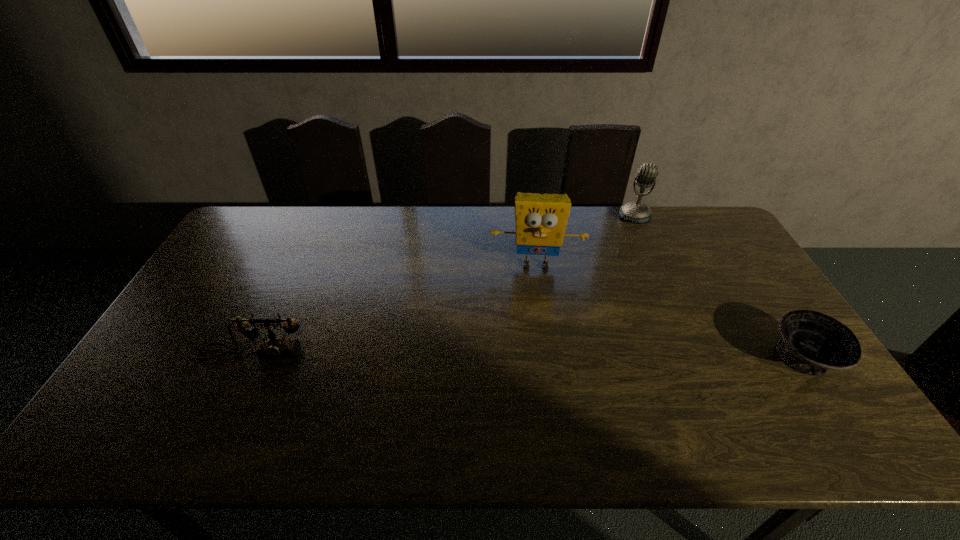
The height and width of the screenshot is (540, 960). I want to click on object located at the near right corner, so click(812, 343).

In the image, there is a desktop. In order to click on blank space at the far edge in this screenshot , I will do `click(654, 224)`.

Where is `free region at the near edge of the desktop`? The width and height of the screenshot is (960, 540). free region at the near edge of the desktop is located at coordinates (656, 396).

In the image, there is a desktop. Where is `vacant space at the left edge`? vacant space at the left edge is located at coordinates (195, 290).

Locate an element on the screen. This screenshot has width=960, height=540. free region at the right edge is located at coordinates (756, 328).

Locate an element on the screen. The width and height of the screenshot is (960, 540). free space at the far left corner of the desktop is located at coordinates (239, 239).

Locate an element on the screen. This screenshot has height=540, width=960. blank space at the near right corner of the desktop is located at coordinates (843, 407).

At what (x,y) coordinates should I click in order to perform the action: click on vacant region between the bowl and the microphone. Please return your answer as a coordinate pair (x, y). Image resolution: width=960 pixels, height=540 pixels. Looking at the image, I should click on tap(719, 287).

Where is `empty location between the rightmost object and the third object from right to left`? The image size is (960, 540). empty location between the rightmost object and the third object from right to left is located at coordinates (670, 312).

Locate an element on the screen. This screenshot has width=960, height=540. vacant space that's between the shortest object and the telephone is located at coordinates (529, 356).